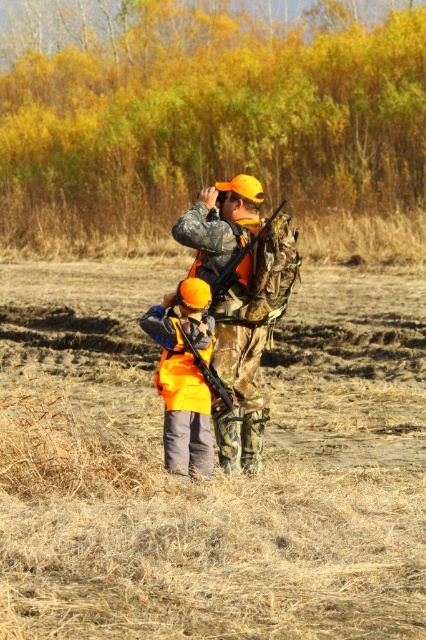
You are a hiker who has just arrived at a clearing in the woods. You see a point marked at coordinates [216,472]. What is located at that point?

The point at coordinates [216,472] indicates brown dry grass at center.

You are a hunter preparing to store your weapons in a vehicle trunk. The trunk has a width of 1.2 meters. The camouflage fabric rifle at center and the matte black shotgun at center are both lying on the ground. Which weapon should you place first to ensure they both fit side by side in the trunk?

The camouflage fabric rifle at center should be placed first on the left side of the matte black shotgun at center because the total width of both weapons combined is less than 1.2 meters, allowing them to fit side by side in the trunk.

You are a photographer trying to capture a clear shot of the hunter in the scene. You notice two points marked in the image. Which point, point 1 at coordinates [247,492] or point 2 at coordinates [218,394], is closer to the camera and thus more likely to be in focus if you focus on it?

Point 1 at coordinates [247,492] is closer to the camera than point 2 at coordinates [218,394], so focusing on it would likely result in a clearer shot of the hunter.